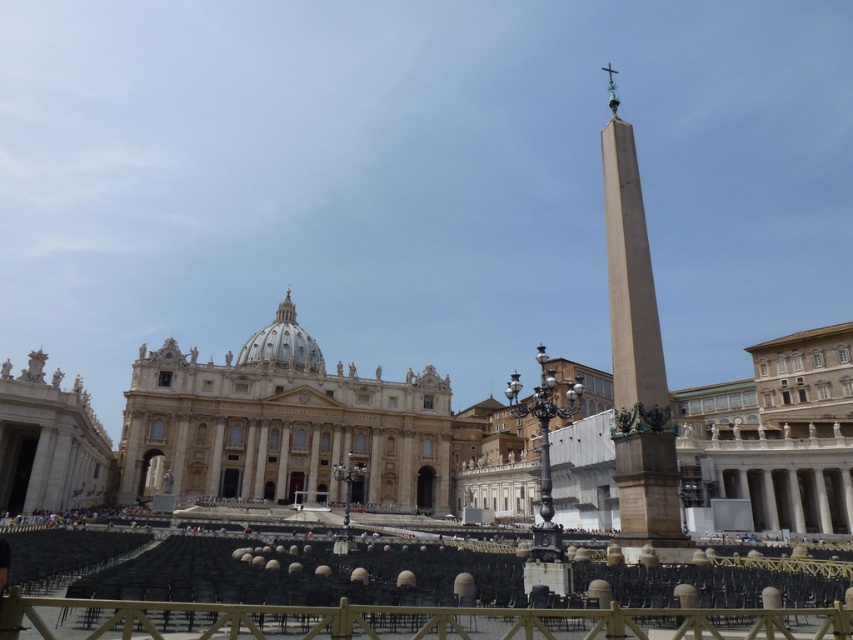
Question: Which point is farther to the camera?

Choices:
 (A) (318, 492)
 (B) (645, 392)

Answer: (A)

Question: Which point appears closest to the camera in this image?

Choices:
 (A) (659, 452)
 (B) (791, 637)
 (C) (216, 404)

Answer: (B)

Question: Does white marble palace at center have a lesser width compared to wooden at center?

Choices:
 (A) yes
 (B) no

Answer: (B)

Question: From the image, what is the correct spatial relationship of white marble palace at center in relation to wooden at center?

Choices:
 (A) left
 (B) right

Answer: (A)

Question: Can you confirm if wooden at center is wider than brown stone obelisk at right?

Choices:
 (A) no
 (B) yes

Answer: (B)

Question: Which of the following is the farthest from the observer?

Choices:
 (A) (273, 460)
 (B) (634, 634)
 (C) (628, 236)

Answer: (A)